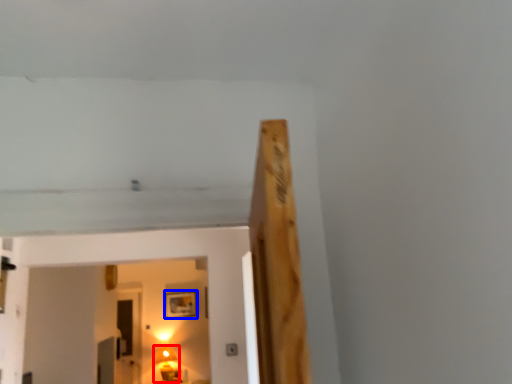
Question: Which point is closer to the camera, lamp (highlighted by a red box) or picture frame (highlighted by a blue box)?

Choices:
 (A) lamp
 (B) picture frame

Answer: (A)